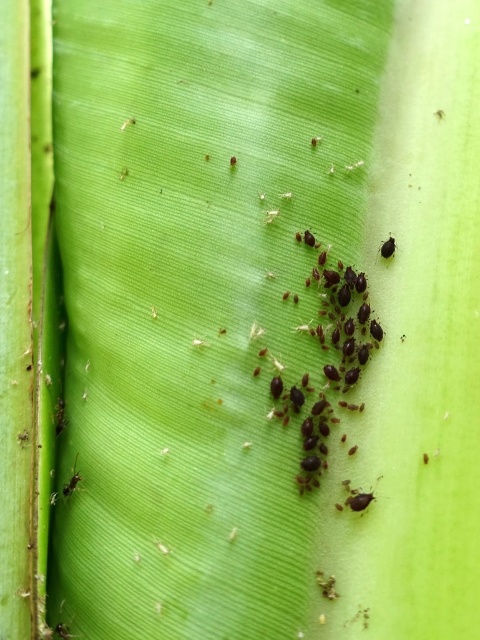
You are a gardener examining a green leaf and notice the black matte insects at center. Where exactly on the leaf are these insects positioned?

The black matte insects at center are located at the coordinates point (x=327, y=365) on the leaf.

You are an entomologist observing a green leaf with insects. You see a black matte ant at lower left and a black matte insect at upper right. Which insect is positioned lower on the leaf?

The black matte ant at lower left is positioned lower on the leaf than the black matte insect at upper right.